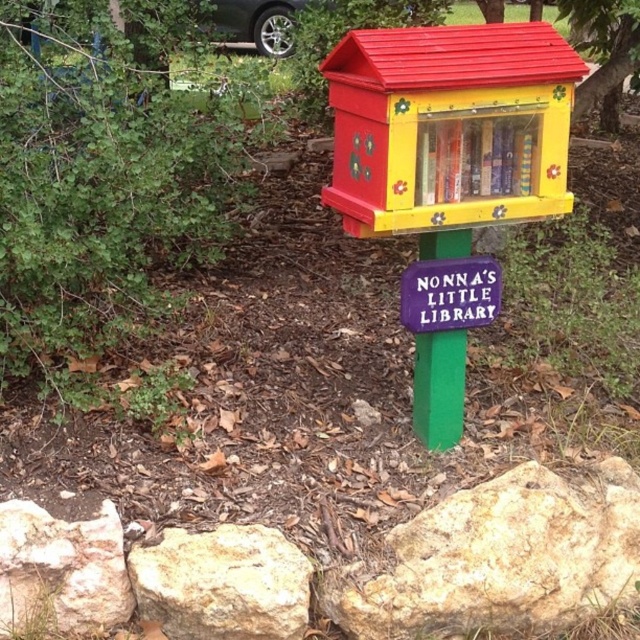
Question: Which point is farther to the camera?

Choices:
 (A) (419, 292)
 (B) (179, 541)

Answer: (A)

Question: Is the position of smooth beige rock at lower left less distant than that of green textured tree at upper right?

Choices:
 (A) no
 (B) yes

Answer: (B)

Question: Does smooth beige rock at lower right come behind smooth beige rock at lower left?

Choices:
 (A) yes
 (B) no

Answer: (A)

Question: Which point is farther to the camera?

Choices:
 (A) white rough rock at lower left
 (B) purple matte sign at center

Answer: (B)

Question: Which point appears closest to the camera in this image?

Choices:
 (A) (490, 317)
 (B) (301, 593)
 (C) (492, 602)
 (D) (432, 147)

Answer: (B)

Question: Does green textured tree at upper right have a smaller size compared to purple matte sign at center?

Choices:
 (A) no
 (B) yes

Answer: (A)